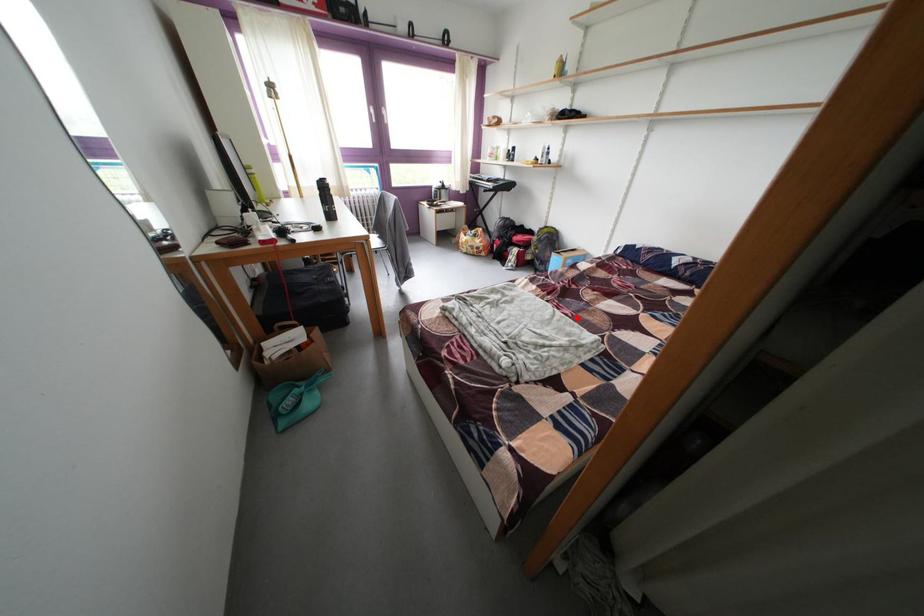
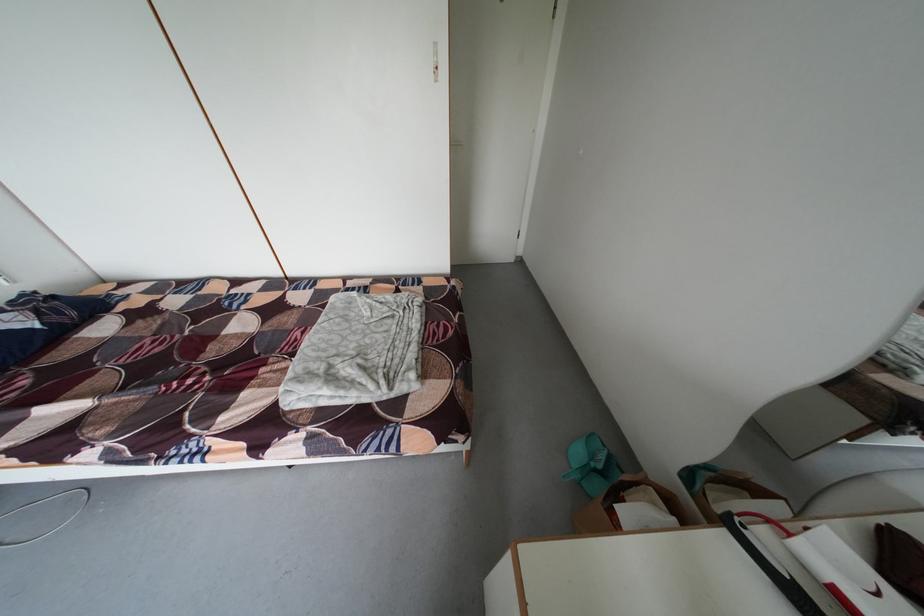
Question: I am providing you with two images of the same scene from different viewpoints. A red point is marked on the first image. At the location where the point appears in image 1, is it still visible in image 2?

Choices:
 (A) Yes
 (B) No

Answer: (A)